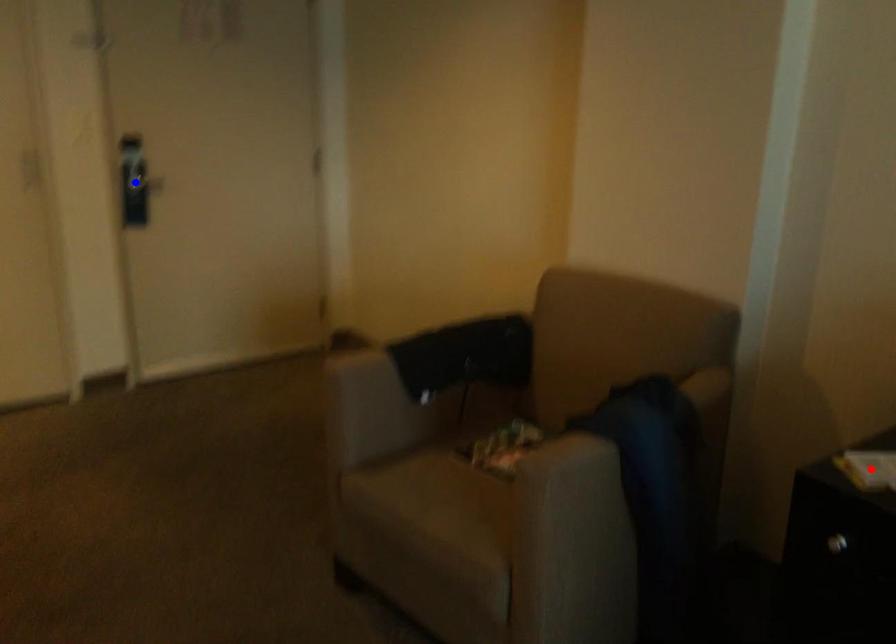
Question: Two points are marked on the image. Which point is closer to the camera?

Choices:
 (A) Blue point is closer.
 (B) Red point is closer.

Answer: (B)